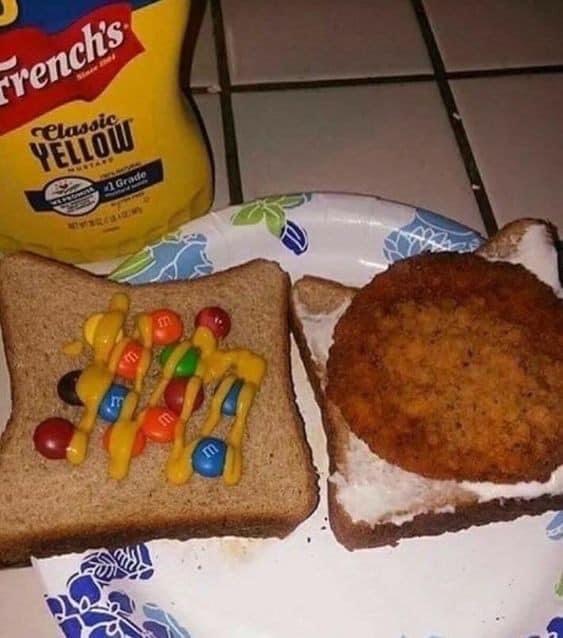
Identify the location of paper plate. (120, 609), (485, 582), (310, 233), (310, 625).